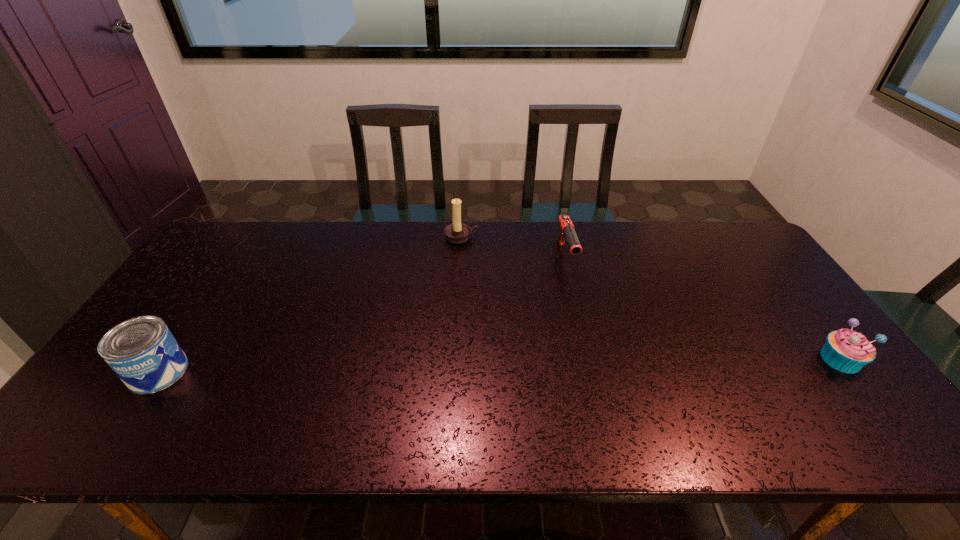
Find the location of `vacant area at the left edge`. vacant area at the left edge is located at coordinates (170, 312).

Locate an element on the screen. Image resolution: width=960 pixels, height=540 pixels. vacant area at the right edge is located at coordinates (818, 335).

Identify the location of free point at the far left corner. (221, 228).

Image resolution: width=960 pixels, height=540 pixels. In the image, there is a desktop. Find the location of `vacant space at the far right corner`. vacant space at the far right corner is located at coordinates (705, 234).

The width and height of the screenshot is (960, 540). I want to click on free space between the tallest object and the can, so click(x=310, y=305).

Find the location of a particular element. free area in between the second object from left to right and the second object from right to left is located at coordinates (514, 247).

Identify the location of vacant point located between the rightmost object and the tallest object. The width and height of the screenshot is (960, 540). (651, 299).

The image size is (960, 540). I want to click on empty space that is in between the rightmost object and the candle holder, so click(x=651, y=299).

Image resolution: width=960 pixels, height=540 pixels. I want to click on free space between the can and the rightmost object, so click(499, 366).

The image size is (960, 540). What are the coordinates of `empty location between the can and the second object from left to right` in the screenshot? It's located at (310, 305).